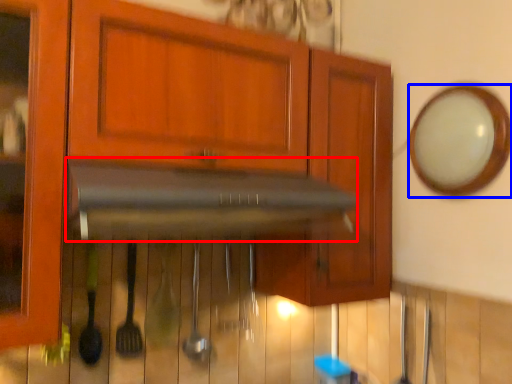
Question: Among these objects, which one is farthest to the camera, vent (highlighted by a red box) or mirror (highlighted by a blue box)?

Choices:
 (A) vent
 (B) mirror

Answer: (B)